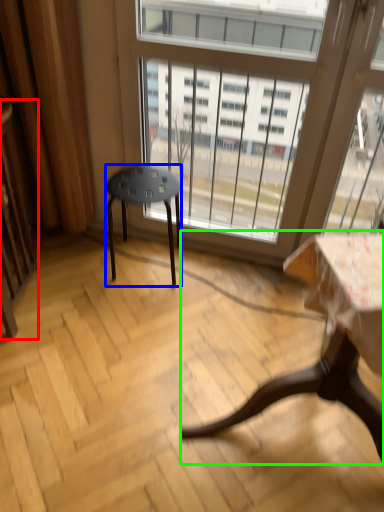
Question: Which object is positioned closest to screen door (highlighted by a red box)? Select from stool (highlighted by a blue box) and table (highlighted by a green box).

Choices:
 (A) stool
 (B) table

Answer: (A)